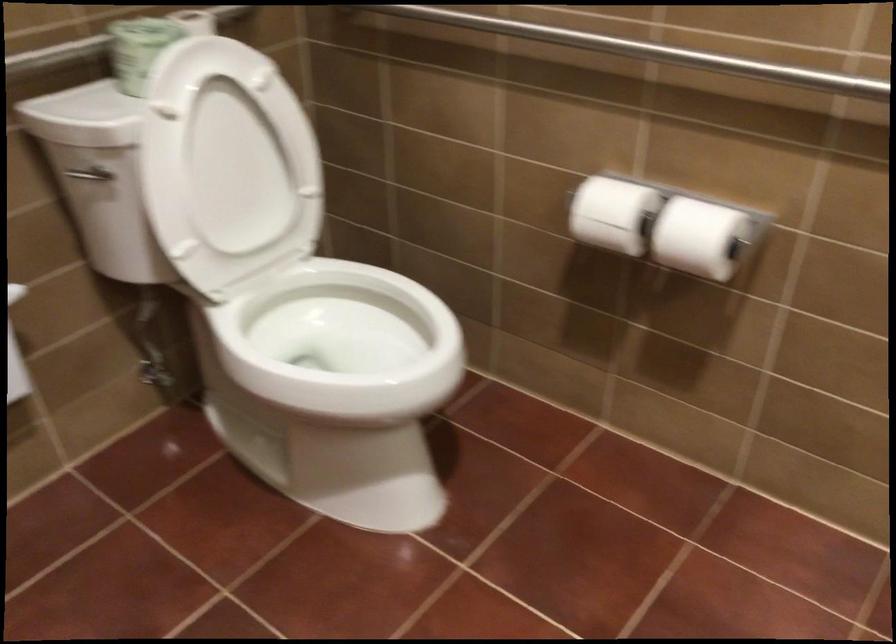
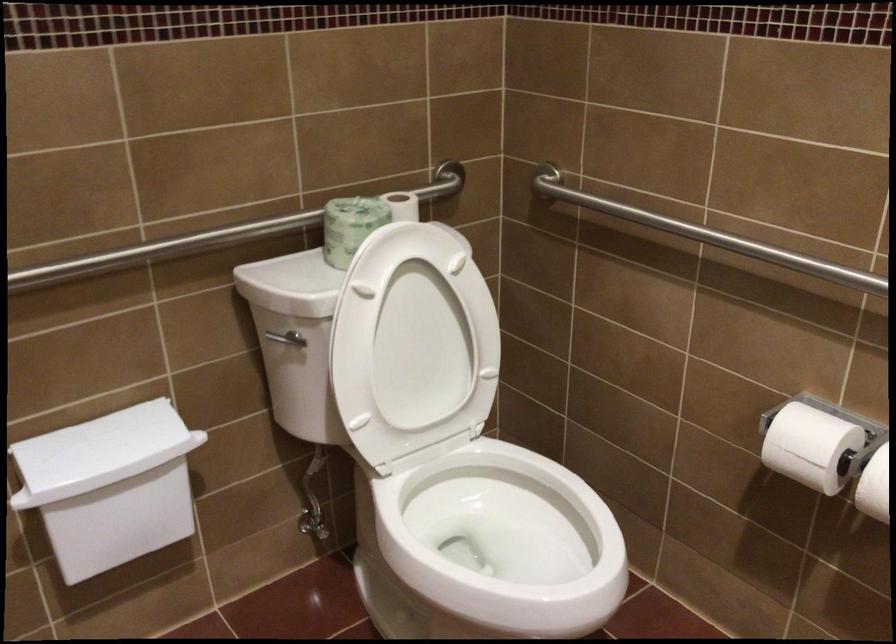
Locate, in the second image, the point that corresponds to pixel 89 183 in the first image.

(281, 343)